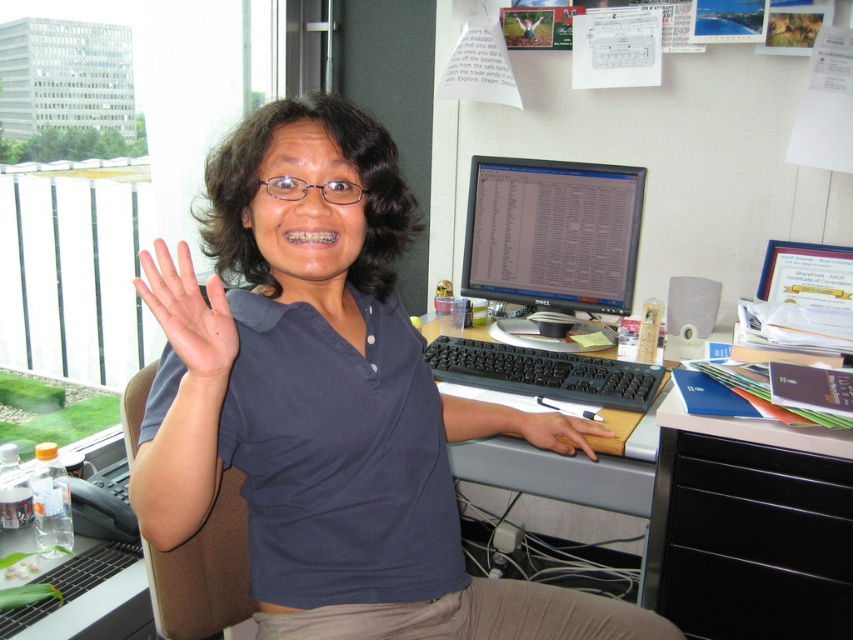
In the scene shown: Who is more forward, (547, 352) or (547, 426)?

Point (547, 426) is in front.

Can you confirm if black plastic keyboard at center is wider than brown leather hand at lower center?

Yes, black plastic keyboard at center is wider than brown leather hand at lower center.

Which is behind, point (474, 355) or point (584, 420)?

Point (474, 355)

Identify the location of black plastic keyboard at center. Image resolution: width=853 pixels, height=640 pixels. (544, 372).

Can you confirm if clear plastic bottle at lower left is bigger than black plastic keyboard at center?

No, clear plastic bottle at lower left is not bigger than black plastic keyboard at center.

Is clear plastic bottle at lower left thinner than black plastic keyboard at center?

Correct, clear plastic bottle at lower left's width is less than black plastic keyboard at center's.

Between point (112, 609) and point (538, 372), which one is positioned in front?

Point (112, 609) is more forward.

You are a GUI agent. You are given a task and a screenshot of the screen. Output one action in this format:
    pyautogui.click(x=<x>, y=<y>)
    Task: Click on the clear plastic bottle at lower left
    Image resolution: width=853 pixels, height=640 pixels.
    Given the screenshot: What is the action you would take?
    pyautogui.click(x=84, y=596)

Is brown fabric swivel chair at left closer to camera compared to brown leather hand at lower center?

Yes.

Is brown fabric swivel chair at left shorter than brown leather hand at lower center?

In fact, brown fabric swivel chair at left may be taller than brown leather hand at lower center.

Which is behind, point (225, 570) or point (555, 435)?

The point (555, 435) is more distant.

I want to click on brown fabric swivel chair at left, so click(204, 572).